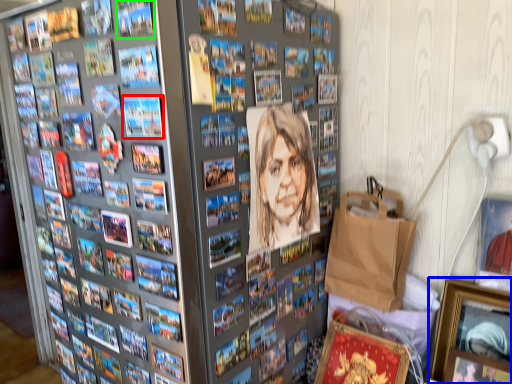
Question: Estimate the real-world distances between objects in this image. Which object is closer to comic book (highlighted by a red box), picture frame (highlighted by a blue box) or comic book (highlighted by a green box)?

Choices:
 (A) picture frame
 (B) comic book

Answer: (B)